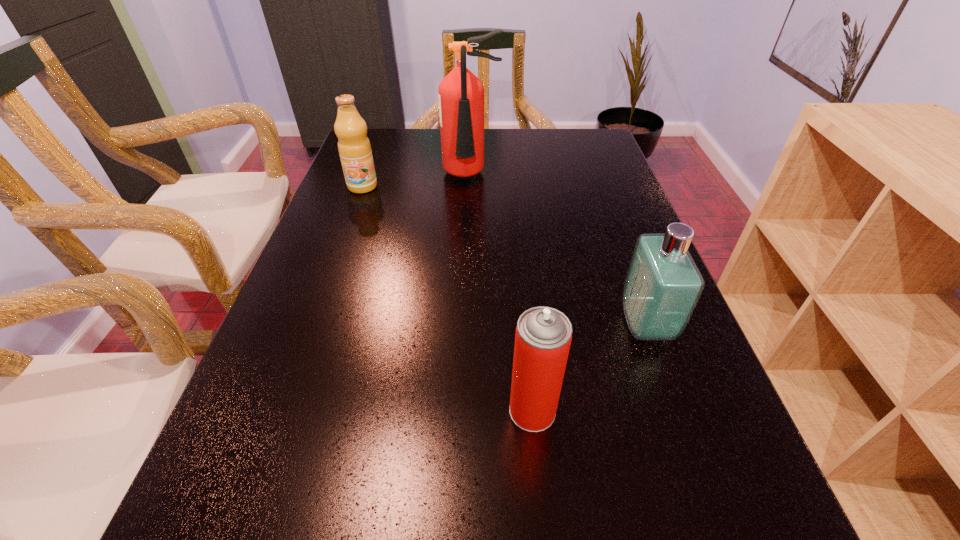
Where is `the tallest object`? The width and height of the screenshot is (960, 540). the tallest object is located at coordinates (461, 94).

Locate an element on the screen. The width and height of the screenshot is (960, 540). fruit juice is located at coordinates (354, 147).

Locate an element on the screen. the nearest object is located at coordinates (543, 336).

Image resolution: width=960 pixels, height=540 pixels. In order to click on perfume in this screenshot , I will do `click(663, 284)`.

Where is `the rightmost object`? the rightmost object is located at coordinates (663, 284).

Where is `vacant area situated 0.190m at the nozzle of the fire extinguisher`? The height and width of the screenshot is (540, 960). vacant area situated 0.190m at the nozzle of the fire extinguisher is located at coordinates (468, 235).

This screenshot has height=540, width=960. Find the location of `vacant space positioned 0.250m on the front label of the fruit juice`. vacant space positioned 0.250m on the front label of the fruit juice is located at coordinates (338, 253).

Find the location of a particular element. The image size is (960, 540). vacant region located 0.250m on the back of the aerosol can is located at coordinates pos(520,288).

Locate an element on the screen. The width and height of the screenshot is (960, 540). free space located 0.290m on the front label of the third farthest object is located at coordinates (476, 325).

The height and width of the screenshot is (540, 960). I want to click on blank area located on the front label of the third farthest object, so click(x=466, y=325).